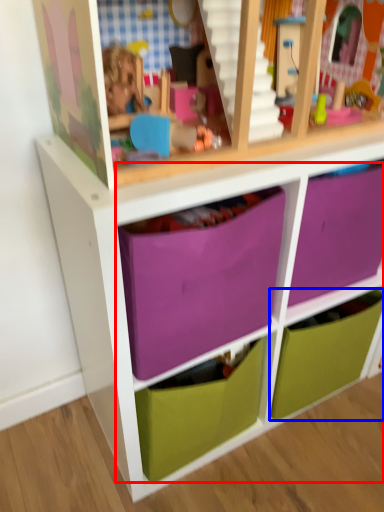
Question: Which point is further to the camera, drawer (highlighted by a red box) or drawer (highlighted by a blue box)?

Choices:
 (A) drawer
 (B) drawer

Answer: (B)